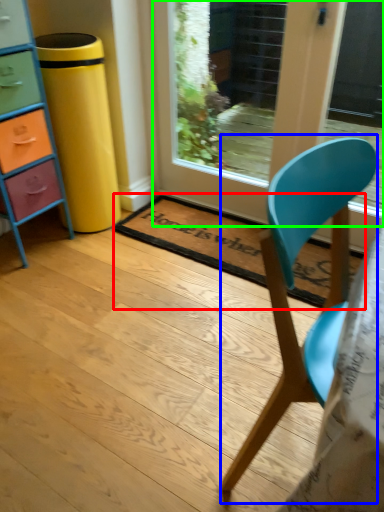
Question: Which is farther away from mat (highlighted by a red box)? chair (highlighted by a blue box) or door (highlighted by a green box)?

Choices:
 (A) chair
 (B) door

Answer: (A)